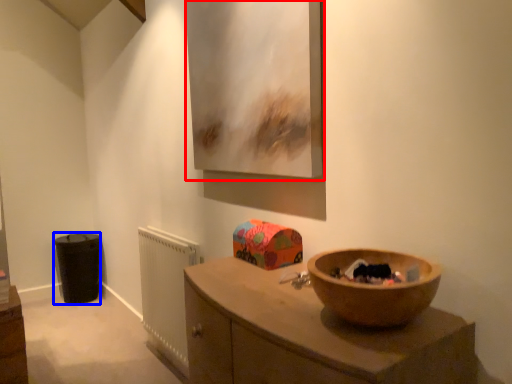
Question: Which point is closer to the camera, picture frame (highlighted by a red box) or cabinetry (highlighted by a blue box)?

Choices:
 (A) picture frame
 (B) cabinetry

Answer: (A)